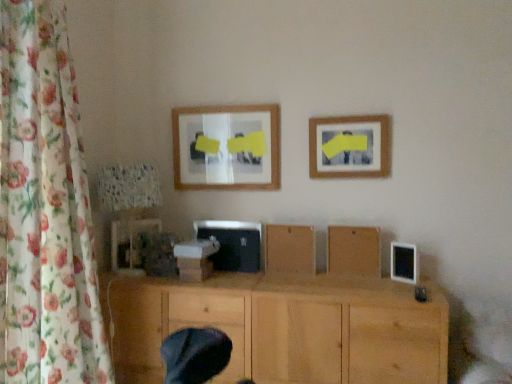
Where is `floral fabric curtain at left`? floral fabric curtain at left is located at coordinates (45, 207).

Describe the element at coordinates (45, 207) in the screenshot. Image resolution: width=512 pixels, height=384 pixels. I see `floral fabric curtain at left` at that location.

In order to face natural wood cabinet at center, arranged as the third wood when viewed from the top, should I rotate leftwards or rightwards?

→ It's best to rotate right around 0.328 degrees.

The height and width of the screenshot is (384, 512). Describe the element at coordinates (226, 147) in the screenshot. I see `matte wooden picture frame at upper center, the third picture frame in the bottom-to-top sequence` at that location.

Measure the distance between point (258, 136) and camera.

They are 7.26 feet apart.

This screenshot has width=512, height=384. In order to click on wooden board at center, the 2th wood in the top-to-bottom sequence in this screenshot , I will do `click(353, 250)`.

What is the approximate height of wooden board at center, the 2th wood in the top-to-bottom sequence?

It is 10.22 inches.

Identify the location of matte plastic picture frame at lower left, the first picture frame in the bottom-to-top sequence. The width and height of the screenshot is (512, 384). click(x=129, y=243).

Is brown matte wood at center, acting as the third wood starting from the bottom, further to the viewer compared to natural wood cabinet at center, the 1th wood in the bottom-to-top sequence?

Yes, it is behind natural wood cabinet at center, the 1th wood in the bottom-to-top sequence.

Considering the positions of objects brown matte wood at center, the first wood viewed from the top, and natural wood cabinet at center, the 1th wood in the bottom-to-top sequence, in the image provided, who is more to the left, brown matte wood at center, the first wood viewed from the top, or natural wood cabinet at center, the 1th wood in the bottom-to-top sequence,?

natural wood cabinet at center, the 1th wood in the bottom-to-top sequence.

Is brown matte wood at center, the first wood viewed from the top, looking in the opposite direction of natural wood cabinet at center, the 1th wood in the bottom-to-top sequence?

No, brown matte wood at center, the first wood viewed from the top,'s orientation is not away from natural wood cabinet at center, the 1th wood in the bottom-to-top sequence.

Measure the distance from brown matte wood at center, the first wood viewed from the top, to natural wood cabinet at center, arranged as the third wood when viewed from the top.

A distance of 33.68 centimeters exists between brown matte wood at center, the first wood viewed from the top, and natural wood cabinet at center, arranged as the third wood when viewed from the top.

Which of these two, matte wooden picture frame at upper center, the second picture frame in the left-to-right sequence, or wooden picture frame at upper right, which is counted as the second picture frame, starting from the bottom, stands taller?

matte wooden picture frame at upper center, the second picture frame in the left-to-right sequence.

From the image's perspective, between matte wooden picture frame at upper center, placed as the second picture frame when sorted from right to left, and wooden picture frame at upper right, arranged as the second picture frame when viewed from the top, who is located below?

wooden picture frame at upper right, arranged as the second picture frame when viewed from the top, appears lower in the image.

Based on the photo, is matte wooden picture frame at upper center, placed as the second picture frame when sorted from right to left, inside the boundaries of wooden picture frame at upper right, which is the first picture frame from right to left, or outside?

The correct answer is: outside.

Between matte wooden picture frame at upper center, the third picture frame in the bottom-to-top sequence, and wooden picture frame at upper right, which is counted as the second picture frame, starting from the bottom, which one is positioned in front?

wooden picture frame at upper right, which is counted as the second picture frame, starting from the bottom, is in front.

From a real-world perspective, is floral fabric curtain at left on top of natural wood cabinet at center, arranged as the third wood when viewed from the top?

Yes.

From the floral fabric curtain at left, count 1st wood to the right and point to it. Please provide its 2D coordinates.

[(284, 327)]

Is floral fabric curtain at left closer to camera compared to natural wood cabinet at center, arranged as the third wood when viewed from the top?

Yes, floral fabric curtain at left is in front of natural wood cabinet at center, arranged as the third wood when viewed from the top.

Is natural wood cabinet at center, the 1th wood in the bottom-to-top sequence, at the back of floral fabric curtain at left?

No, natural wood cabinet at center, the 1th wood in the bottom-to-top sequence, is not at the back of floral fabric curtain at left.

Image resolution: width=512 pixels, height=384 pixels. I want to click on the 3rd picture frame counting from the left of the wooden board at center, marked as the 2th wood in a bottom-to-top arrangement, so click(x=129, y=243).

From a real-world perspective, is wooden board at center, marked as the 2th wood in a bottom-to-top arrangement, positioned under matte plastic picture frame at lower left, which is the 3th picture frame in right-to-left order, based on gravity?

Yes, from a real-world perspective, wooden board at center, marked as the 2th wood in a bottom-to-top arrangement, is below matte plastic picture frame at lower left, which is the 3th picture frame in right-to-left order.

Is matte plastic picture frame at lower left, which is counted as the third picture frame, starting from the top, a part of wooden board at center, the 2th wood in the top-to-bottom sequence?

No, matte plastic picture frame at lower left, which is counted as the third picture frame, starting from the top, is not a part of wooden board at center, the 2th wood in the top-to-bottom sequence.

Which object is thinner, wooden board at center, marked as the 2th wood in a bottom-to-top arrangement, or matte plastic picture frame at lower left, which is counted as the third picture frame, starting from the top?

wooden board at center, marked as the 2th wood in a bottom-to-top arrangement.

Considering the sizes of objects natural wood cabinet at center, the 1th wood in the bottom-to-top sequence, and wooden board at center, marked as the 2th wood in a bottom-to-top arrangement, in the image provided, who is shorter, natural wood cabinet at center, the 1th wood in the bottom-to-top sequence, or wooden board at center, marked as the 2th wood in a bottom-to-top arrangement,?

With less height is wooden board at center, marked as the 2th wood in a bottom-to-top arrangement.

The width and height of the screenshot is (512, 384). Identify the location of wood that is the 2nd one when counting rightward from the natural wood cabinet at center, the 1th wood in the bottom-to-top sequence. (353, 250).

Looking at this image, from a real-world perspective, is natural wood cabinet at center, the 1th wood in the bottom-to-top sequence, physically located above or below wooden board at center, marked as the 2th wood in a bottom-to-top arrangement?

Clearly, from a real-world perspective, natural wood cabinet at center, the 1th wood in the bottom-to-top sequence, is below wooden board at center, marked as the 2th wood in a bottom-to-top arrangement.

In the scene shown: Is natural wood cabinet at center, arranged as the third wood when viewed from the top, turned away from wooden board at center, the 2th wood in the top-to-bottom sequence?

No, natural wood cabinet at center, arranged as the third wood when viewed from the top, is not facing the opposite direction of wooden board at center, the 2th wood in the top-to-bottom sequence.

Which of these two, brown matte wood at center, the first wood viewed from the top, or matte wooden picture frame at upper center, arranged as the 1th picture frame when viewed from the top, stands taller?

Standing taller between the two is matte wooden picture frame at upper center, arranged as the 1th picture frame when viewed from the top.

Is brown matte wood at center, the first wood viewed from the top, at the left side of matte wooden picture frame at upper center, arranged as the 1th picture frame when viewed from the top?

Incorrect, brown matte wood at center, the first wood viewed from the top, is not on the left side of matte wooden picture frame at upper center, arranged as the 1th picture frame when viewed from the top.

What's the angular difference between brown matte wood at center, acting as the third wood starting from the bottom, and matte wooden picture frame at upper center, arranged as the 1th picture frame when viewed from the top,'s facing directions?

The angle between the facing direction of brown matte wood at center, acting as the third wood starting from the bottom, and the facing direction of matte wooden picture frame at upper center, arranged as the 1th picture frame when viewed from the top, is 5.55 degrees.

Considering their positions, is brown matte wood at center, the first wood viewed from the top, located in front of or behind matte wooden picture frame at upper center, placed as the second picture frame when sorted from right to left?

brown matte wood at center, the first wood viewed from the top, is in front of matte wooden picture frame at upper center, placed as the second picture frame when sorted from right to left.

Would you say matte wooden picture frame at upper center, the third picture frame in the bottom-to-top sequence, is inside or outside brown matte wood at center, acting as the third wood starting from the bottom?

matte wooden picture frame at upper center, the third picture frame in the bottom-to-top sequence, cannot be found inside brown matte wood at center, acting as the third wood starting from the bottom.

Is point (277, 131) positioned before point (294, 251)?

No, (277, 131) is behind (294, 251).

Considering the positions of objects matte wooden picture frame at upper center, the third picture frame in the bottom-to-top sequence, and brown matte wood at center, the first wood viewed from the top, in the image provided, who is in front, matte wooden picture frame at upper center, the third picture frame in the bottom-to-top sequence, or brown matte wood at center, the first wood viewed from the top,?

brown matte wood at center, the first wood viewed from the top, is in front.

Is matte wooden picture frame at upper center, placed as the second picture frame when sorted from right to left, facing towards brown matte wood at center, the first wood viewed from the top?

No, matte wooden picture frame at upper center, placed as the second picture frame when sorted from right to left, is not facing towards brown matte wood at center, the first wood viewed from the top.

In order to click on the 2nd wood behind the natural wood cabinet at center, the 1th wood in the bottom-to-top sequence in this screenshot , I will do `click(290, 249)`.

Locate an element on the screen. The image size is (512, 384). picture frame on the right of matte wooden picture frame at upper center, arranged as the 1th picture frame when viewed from the top is located at coordinates (350, 146).

From the image, which object appears to be farther from matte wooden picture frame at upper center, the third picture frame in the bottom-to-top sequence, wooden picture frame at upper right, which is the first picture frame from right to left, or wooden board at center, marked as the 2th wood in a bottom-to-top arrangement?

wooden board at center, marked as the 2th wood in a bottom-to-top arrangement.

Considering their positions, is matte wooden picture frame at upper center, placed as the second picture frame when sorted from right to left, positioned further to floral fabric curtain at left than wooden board at center, the 2th wood in the top-to-bottom sequence?

wooden board at center, the 2th wood in the top-to-bottom sequence.

Looking at the image, which one is located closer to matte plastic picture frame at lower left, which is the 3th picture frame in right-to-left order, natural wood cabinet at center, arranged as the third wood when viewed from the top, or brown matte wood at center, acting as the third wood starting from the bottom?

Based on the image, natural wood cabinet at center, arranged as the third wood when viewed from the top, appears to be nearer to matte plastic picture frame at lower left, which is the 3th picture frame in right-to-left order.

From the picture: Considering their positions, is matte plastic picture frame at lower left, which is the 3th picture frame in right-to-left order, positioned closer to wooden picture frame at upper right, which is the first picture frame from right to left, than matte wooden picture frame at upper center, placed as the second picture frame when sorted from right to left?

Based on the image, matte wooden picture frame at upper center, placed as the second picture frame when sorted from right to left, appears to be nearer to wooden picture frame at upper right, which is the first picture frame from right to left.

Which object lies nearer to the anchor point floral fabric curtain at left, matte wooden picture frame at upper center, the second picture frame in the left-to-right sequence, or wooden picture frame at upper right, which is counted as the second picture frame, starting from the bottom?

matte wooden picture frame at upper center, the second picture frame in the left-to-right sequence, is positioned closer to the anchor floral fabric curtain at left.

Which object lies nearer to the anchor point natural wood cabinet at center, the 1th wood in the bottom-to-top sequence, matte wooden picture frame at upper center, the third picture frame in the bottom-to-top sequence, or brown matte wood at center, the first wood viewed from the top?

The object closer to natural wood cabinet at center, the 1th wood in the bottom-to-top sequence, is brown matte wood at center, the first wood viewed from the top.

Looking at the image, which one is located further to natural wood cabinet at center, arranged as the third wood when viewed from the top, wooden board at center, the 2th wood in the top-to-bottom sequence, or wooden picture frame at upper right, arranged as the second picture frame when viewed from the top?

The object further to natural wood cabinet at center, arranged as the third wood when viewed from the top, is wooden picture frame at upper right, arranged as the second picture frame when viewed from the top.

Based on the photo, when comparing their distances from wooden board at center, the 2th wood in the top-to-bottom sequence, does matte wooden picture frame at upper center, arranged as the 1th picture frame when viewed from the top, or brown matte wood at center, the first wood viewed from the top, seem further?

Among the two, matte wooden picture frame at upper center, arranged as the 1th picture frame when viewed from the top, is located further to wooden board at center, the 2th wood in the top-to-bottom sequence.

At what (x,y) coordinates should I click in order to perform the action: click on picture frame between matte wooden picture frame at upper center, the second picture frame in the left-to-right sequence, and wooden board at center, the 2th wood in the top-to-bottom sequence, from left to right. Please return your answer as a coordinate pair (x, y). This screenshot has height=384, width=512. Looking at the image, I should click on (350, 146).

Locate an element on the screen. This screenshot has height=384, width=512. wood between matte plastic picture frame at lower left, which is counted as the third picture frame, starting from the top, and brown matte wood at center, acting as the third wood starting from the bottom, from left to right is located at coordinates coord(284,327).

You are a GUI agent. You are given a task and a screenshot of the screen. Output one action in this format:
    pyautogui.click(x=<x>, y=<y>)
    Task: Click on the wood between wooden picture frame at upper right, arranged as the second picture frame when viewed from the top, and wooden board at center, marked as the 2th wood in a bottom-to-top arrangement, from top to bottom
    Image resolution: width=512 pixels, height=384 pixels.
    Given the screenshot: What is the action you would take?
    pyautogui.click(x=290, y=249)

In order to click on picture frame between matte plastic picture frame at lower left, which is the 3th picture frame in right-to-left order, and brown matte wood at center, acting as the third wood starting from the bottom, from left to right in this screenshot , I will do `click(226, 147)`.